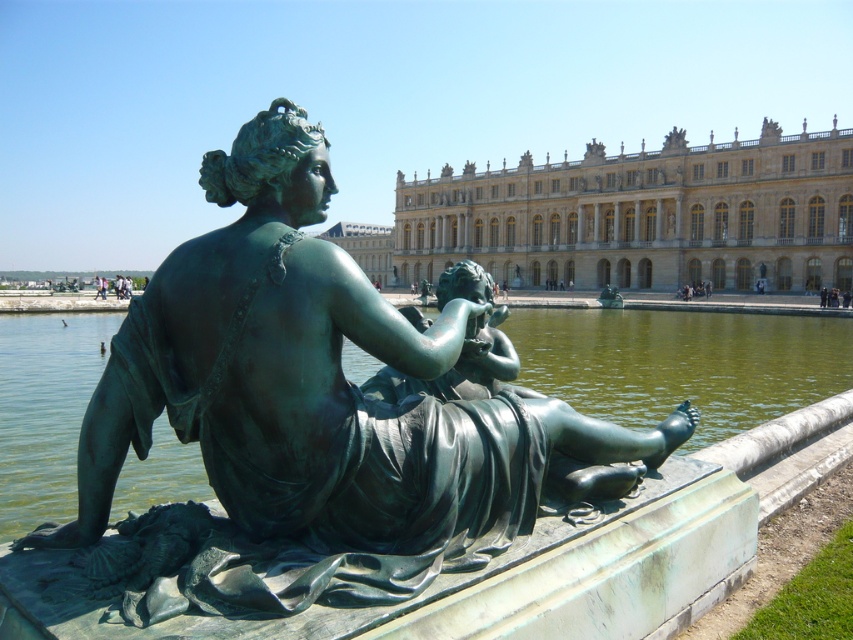
Question: Which object is closer to the camera taking this photo?

Choices:
 (A) golden stone palace at center
 (B) green patina water at statue center
 (C) green patina statue at center

Answer: (C)

Question: Which object is positioned closest to the golden stone palace at center?

Choices:
 (A) green patina statue at center
 (B) green patina water at statue center

Answer: (B)

Question: Is golden stone palace at center positioned at the back of green patina water at statue center?

Choices:
 (A) no
 (B) yes

Answer: (B)

Question: Among these objects, which one is nearest to the camera?

Choices:
 (A) green patina water at statue center
 (B) golden stone palace at center

Answer: (A)

Question: Is golden stone palace at center in front of green patina water at statue center?

Choices:
 (A) no
 (B) yes

Answer: (A)

Question: Is green patina statue at center thinner than green patina water at statue center?

Choices:
 (A) yes
 (B) no

Answer: (A)